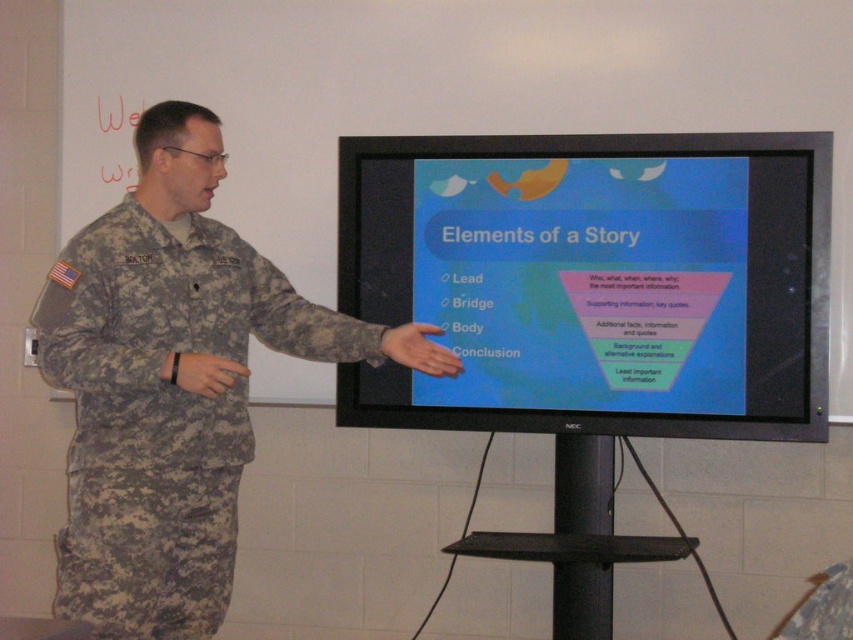
In the scene shown: You are an attendee at a lecture and need to take notes. The matte black monitor at center shows the presentation slide. Where should you look to see the slide content while also keeping an eye on the camouflage fabric uniform at left of the speaker?

The matte black monitor at center is smaller than the camouflage fabric uniform at left, so you should focus on the matte black monitor at center to see the slide content while glancing at the camouflage fabric uniform at left to watch the speaker.

You are an attendee at the presentation and want to know which of the two points, point (601, 426) or point (254, 292), is closer to you. Which one is closer?

Point (254, 292) is closer to you because it is less further to the viewer than point (601, 426).

You are an attendee at this presentation. You want to take a photo of the presentation slide on the matte black monitor at center without blocking the camouflage fabric uniform at left of the presenter. Is the monitor tall enough to be fully visible in your phone camera without moving your phone up or down?

The matte black monitor at center is not as tall as the camouflage fabric uniform at left, so it is shorter and therefore fully visible without needing to adjust the phone camera angle.